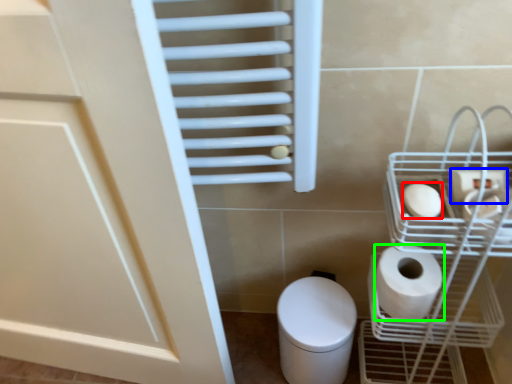
Question: Which object is positioned farthest from toilet paper (highlighted by a red box)? Select from toilet paper (highlighted by a blue box) and toilet paper (highlighted by a green box).

Choices:
 (A) toilet paper
 (B) toilet paper

Answer: (B)